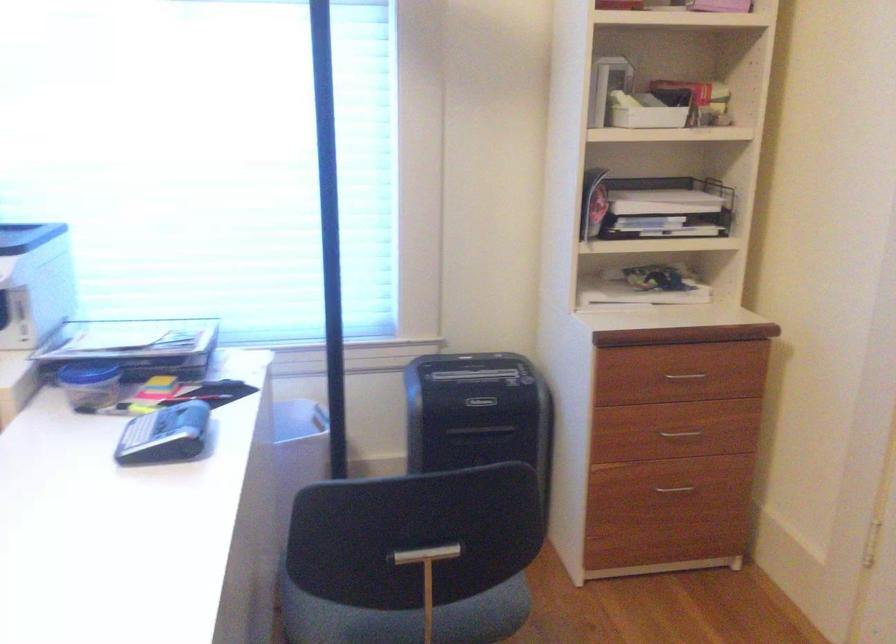
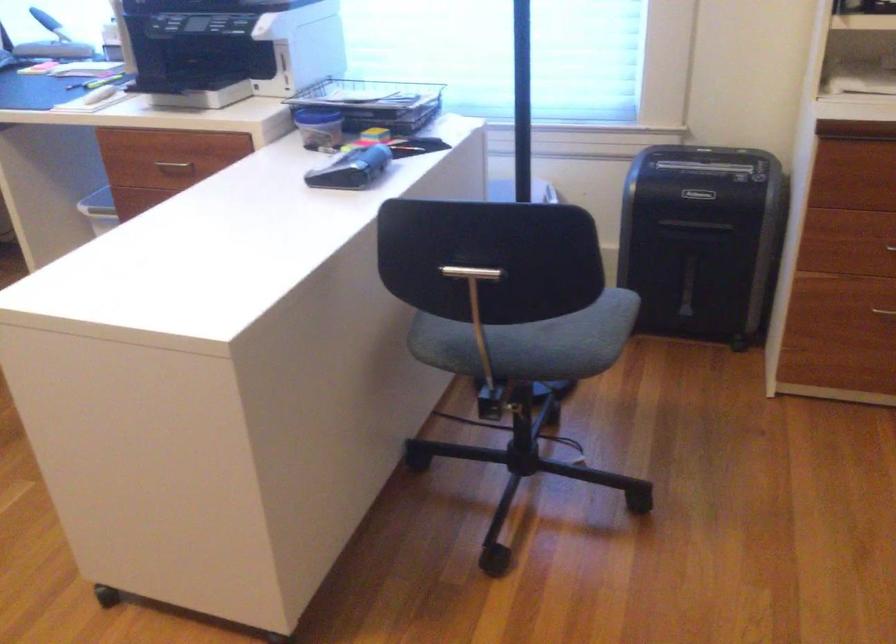
Find the pixel in the second image that matches [666,491] in the first image.

(883, 313)